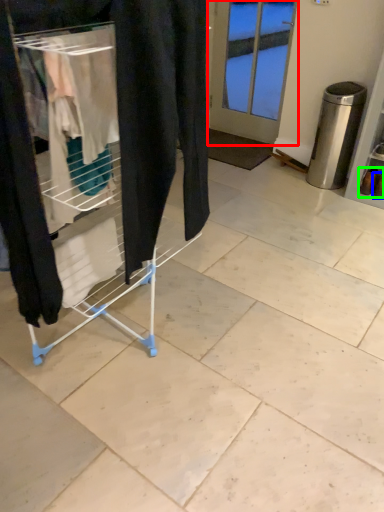
Question: Which is nearer to the door (highlighted by a red box)? footwear (highlighted by a blue box) or footwear (highlighted by a green box).

Choices:
 (A) footwear
 (B) footwear

Answer: (B)